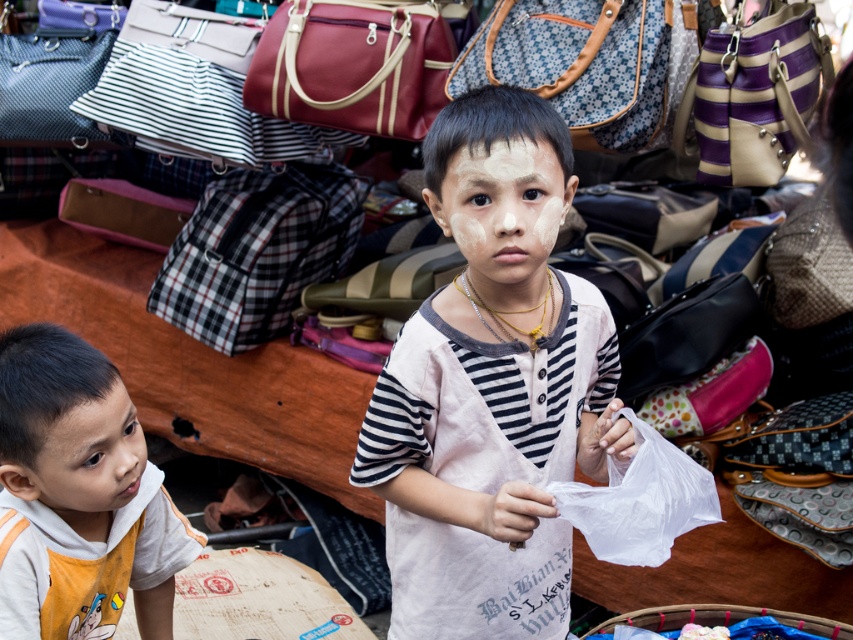
Question: Based on their relative distances, which object is nearer to the orange cotton shirt at lower left?

Choices:
 (A) plaid fabric bag at center
 (B) maroon fabric handbag at upper center

Answer: (B)

Question: Does purple striped leather handbag at upper right appear over smooth skin face at lower left?

Choices:
 (A) yes
 (B) no

Answer: (A)

Question: Estimate the real-world distances between objects in this image. Which object is closer to the purple striped leather handbag at upper right?

Choices:
 (A) white matte face at center
 (B) blue-patterned fabric bag at upper center

Answer: (B)

Question: Which point is farther to the camera?

Choices:
 (A) smooth skin face at lower left
 (B) plaid fabric bag at center
 (C) purple striped leather handbag at upper right
 (D) orange cotton shirt at lower left

Answer: (B)

Question: Is blue-patterned fabric bag at upper center bigger than white matte face at center?

Choices:
 (A) no
 (B) yes

Answer: (B)

Question: Does orange cotton shirt at lower left appear on the left side of blue-patterned fabric bag at upper center?

Choices:
 (A) no
 (B) yes

Answer: (B)